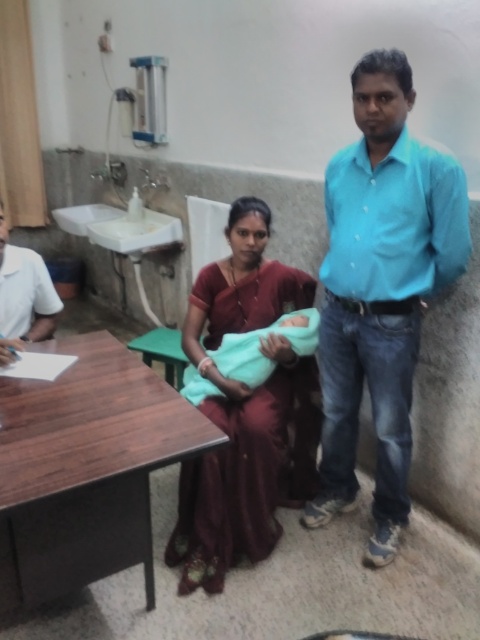
Question: Which point appears closest to the camera in this image?

Choices:
 (A) (332, 296)
 (B) (216, 461)

Answer: (B)

Question: Can you confirm if blue cotton shirt at right is positioned to the right of maroon silk saree at center?

Choices:
 (A) yes
 (B) no

Answer: (A)

Question: Does wooden table at lower left appear over maroon silk saree at center?

Choices:
 (A) yes
 (B) no

Answer: (B)

Question: Considering the real-world distances, which object is farthest from the maroon silk saree at center?

Choices:
 (A) white smooth shirt at left
 (B) wooden table at lower left
 (C) blue cotton shirt at right

Answer: (A)

Question: Which of these objects is positioned farthest from the maroon silk saree at center?

Choices:
 (A) white smooth shirt at left
 (B) blue cotton shirt at right

Answer: (A)

Question: Does wooden table at lower left come behind white smooth shirt at left?

Choices:
 (A) no
 (B) yes

Answer: (A)